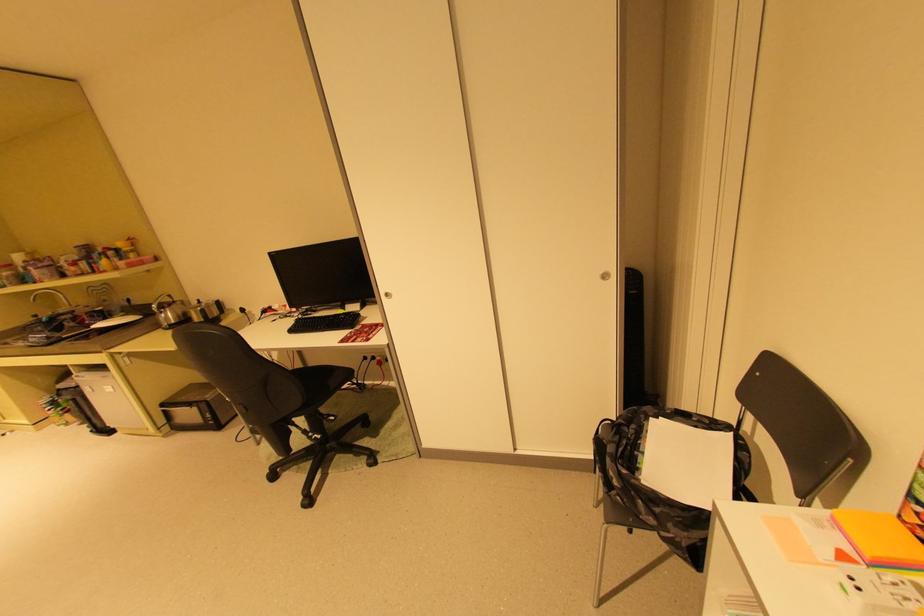
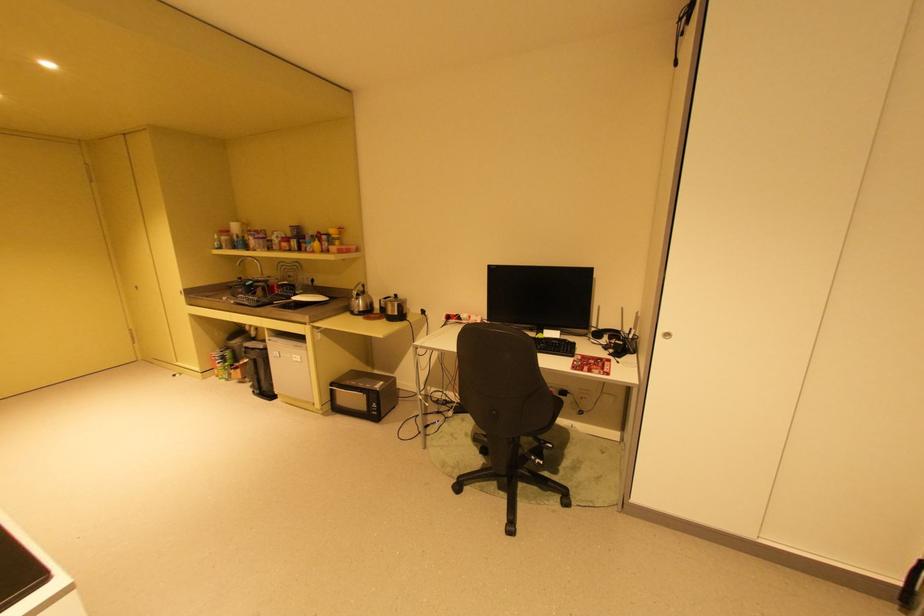
In the second image, find the point that corresponds to (199,385) in the first image.

(359, 371)